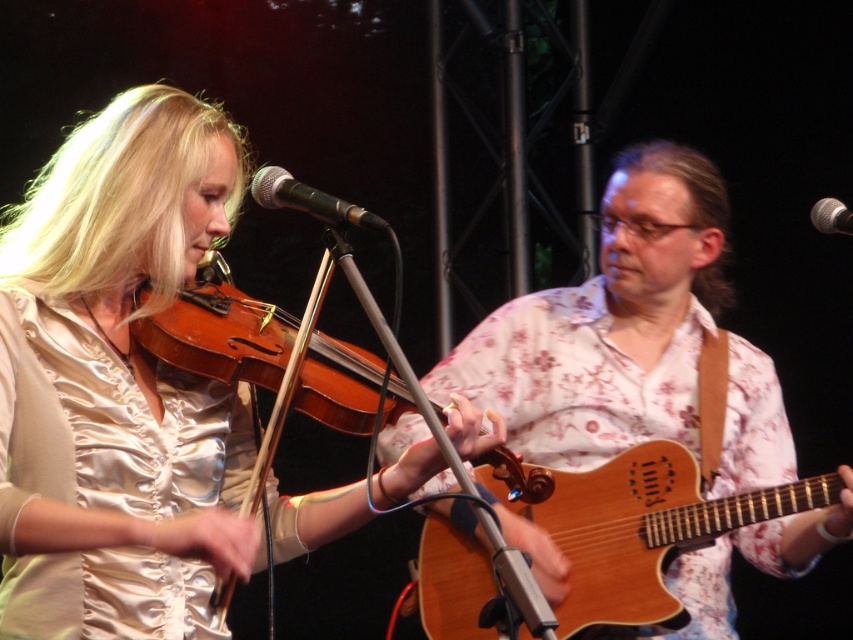
You are a photographer at the back of the stage. You want to take a photo of the metallic silver microphone at center and the wooden acoustic guitar at center without any obstruction. Which object should you move first to ensure both are visible?

The metallic silver microphone at center is behind the wooden acoustic guitar at center. To ensure both are visible, you should move the wooden acoustic guitar at center first so that it no longer blocks the microphone.

You are a stagehand who needs to place a 1.5 meter long ladder between the wooden violin at center and the nearest musician. Is there enough space?

The distance between the wooden violin at center and the nearest musician is 1.58 meters. Since the ladder is 1.5 meters long, there is enough space to place it between them.